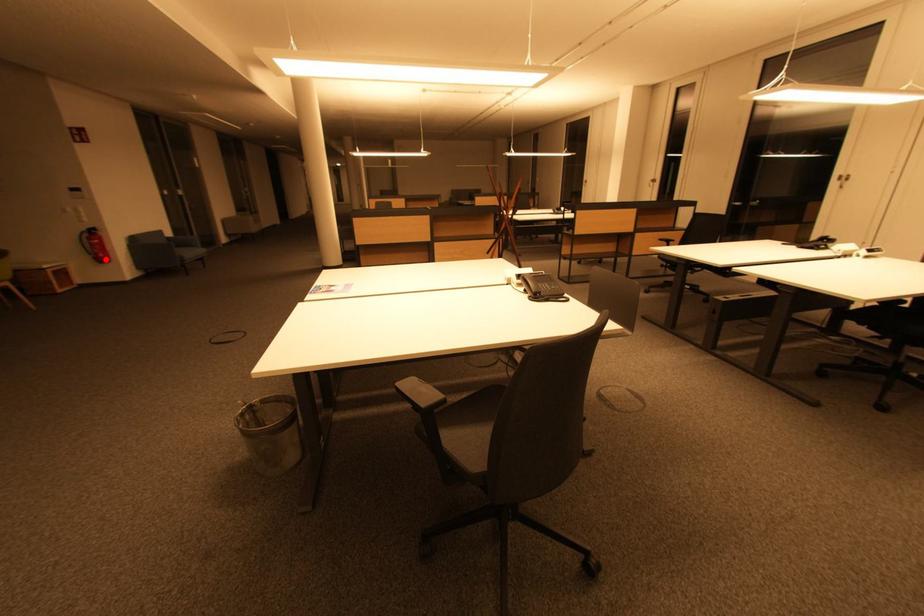
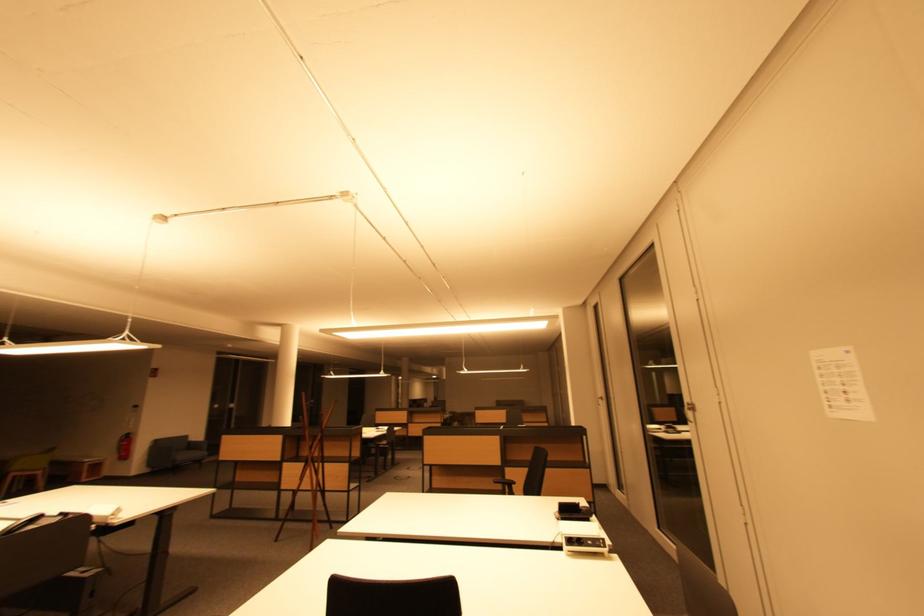
Locate, in the second image, the point that corresponds to the highlighted location in the first image.

(128, 458)